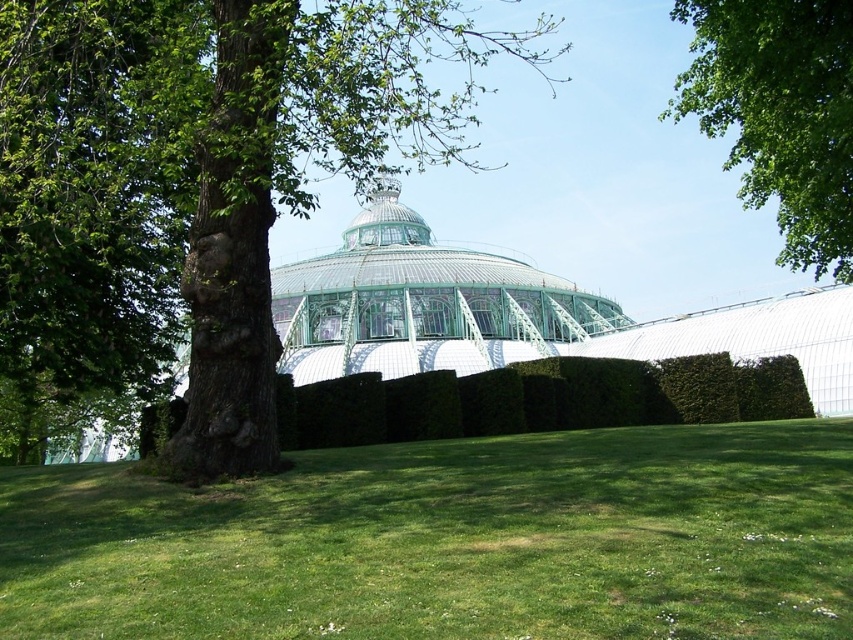
Question: Does green grass at center appear on the right side of green leafy tree at upper right?

Choices:
 (A) yes
 (B) no

Answer: (B)

Question: Which point is closer to the camera?

Choices:
 (A) (801, 129)
 (B) (370, 220)
 (C) (245, 134)

Answer: (C)

Question: Considering the real-world distances, which object is closest to the green leafy tree at upper right?

Choices:
 (A) green glass dome at center
 (B) green grass at center
 (C) green rough bark tree at left

Answer: (B)

Question: Is green rough bark tree at left to the left of green glass dome at center from the viewer's perspective?

Choices:
 (A) yes
 (B) no

Answer: (A)

Question: Where is green grass at center located in relation to green rough bark tree at left in the image?

Choices:
 (A) left
 (B) right

Answer: (B)

Question: Which point is farther to the camera?

Choices:
 (A) (26, 140)
 (B) (262, 497)
 (C) (372, 266)
 (D) (801, 90)

Answer: (C)